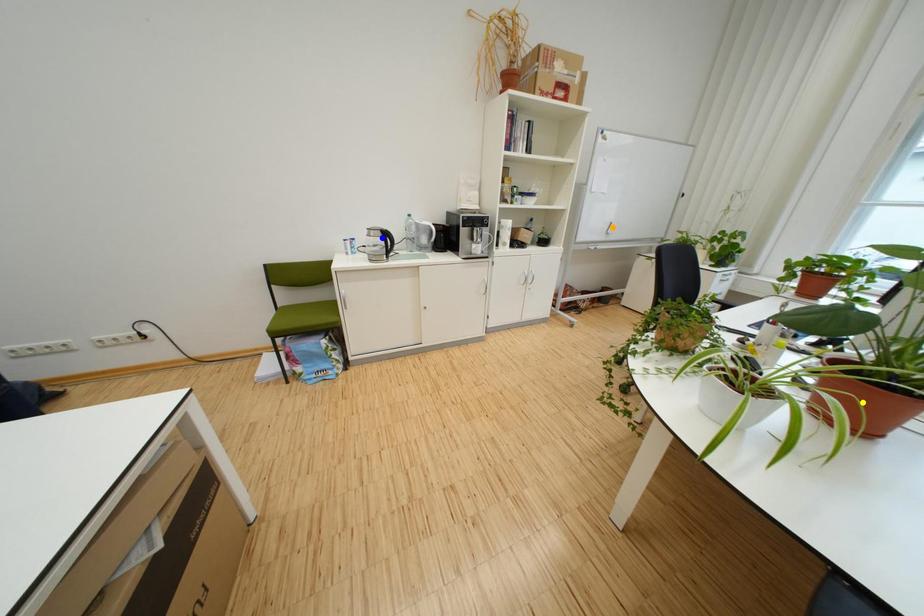
Order these from nearest to farthest:
- yellow point
- orange point
- blue point

yellow point → blue point → orange point